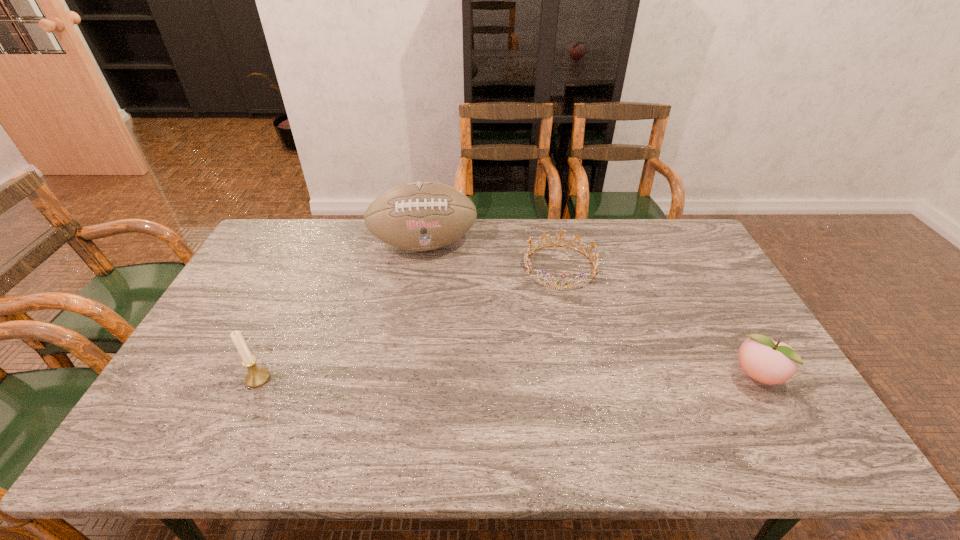
This screenshot has width=960, height=540. Find the location of `vacant point that satisfies the following two spatial constraints: 1. on the front side of the rightmost object; 2. on the left side of the second object from left to right`. vacant point that satisfies the following two spatial constraints: 1. on the front side of the rightmost object; 2. on the left side of the second object from left to right is located at coordinates (403, 377).

This screenshot has height=540, width=960. I want to click on free space that satisfies the following two spatial constraints: 1. on the front side of the tiara; 2. on the right side of the football (American), so click(x=420, y=267).

Locate an element on the screen. This screenshot has height=540, width=960. vacant region that satisfies the following two spatial constraints: 1. on the front side of the tiara; 2. on the left side of the peach is located at coordinates (584, 377).